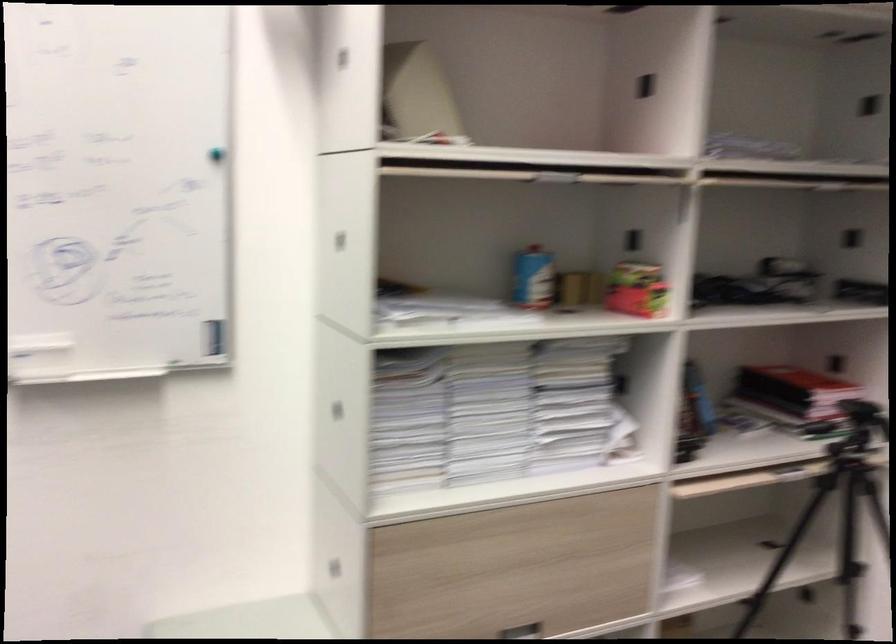
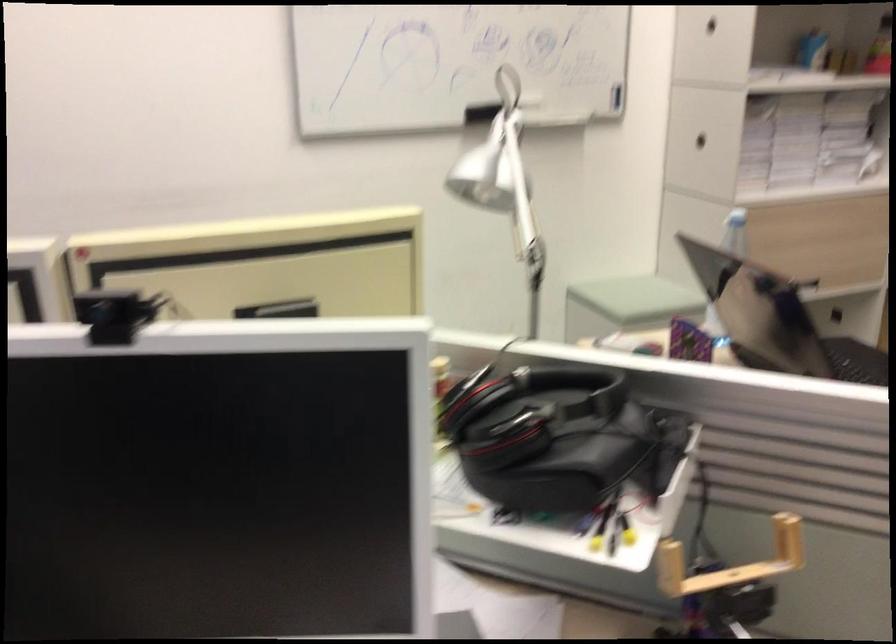
What movement of the cameraman would produce the second image?

The cameraman moved toward left, backward.